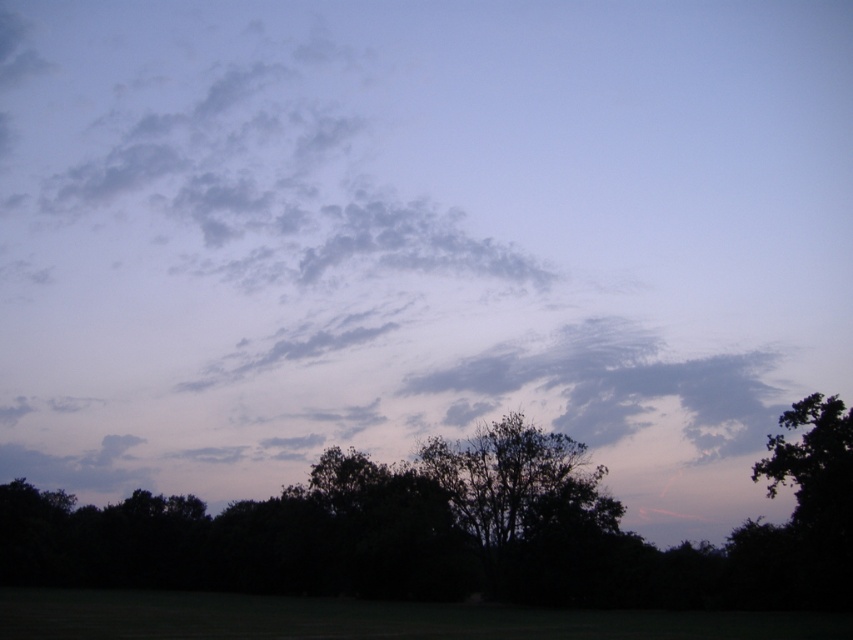
You are standing in the serene landscape depicted in the image. You notice a specific point at coordinates (454, 532). What object in the scene is located at this point?

The point at coordinates (454, 532) corresponds to the silhouette tree at lower center.